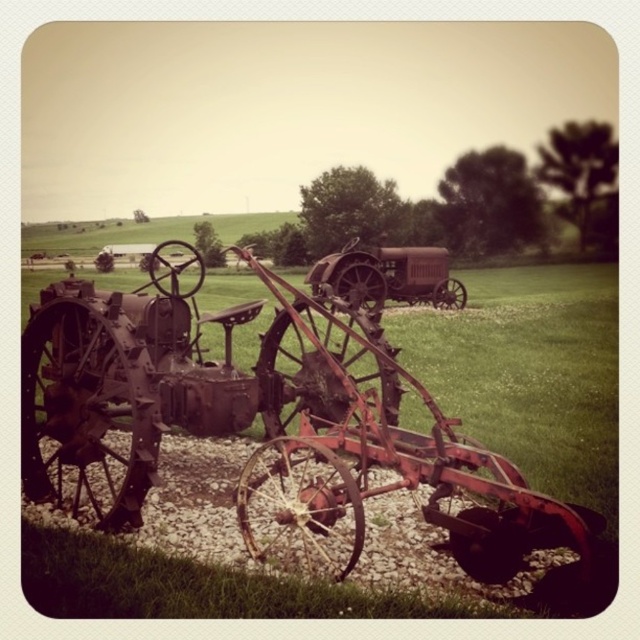
Does rusty metal tractor at left have a lesser height compared to rusty metal tractor at center?

In fact, rusty metal tractor at left may be taller than rusty metal tractor at center.

Who is more forward, (300, 392) or (406, 275)?

Positioned in front is point (300, 392).

Identify the location of rusty metal tractor at left. This screenshot has height=640, width=640. (266, 426).